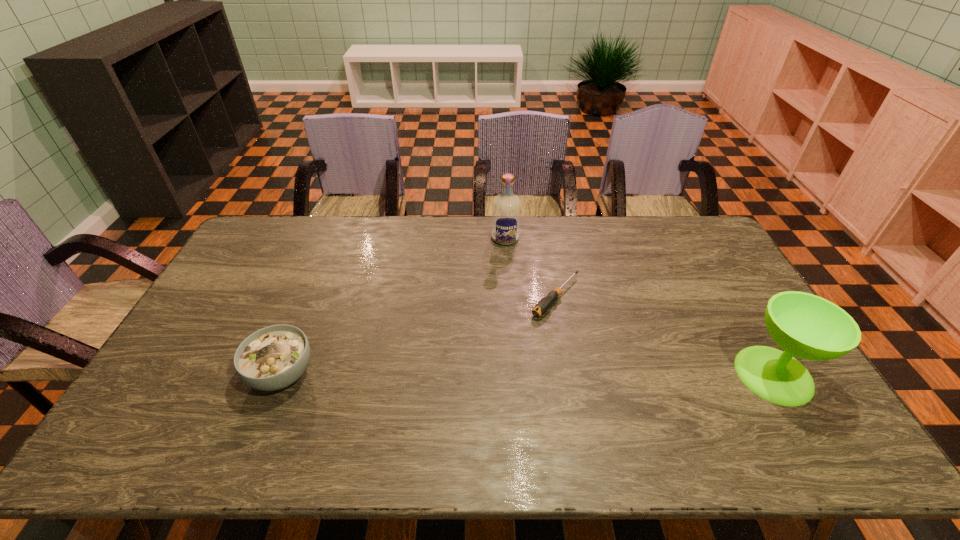
This screenshot has height=540, width=960. I want to click on the second shortest object, so click(272, 358).

Image resolution: width=960 pixels, height=540 pixels. What are the coordinates of `soup bowl` in the screenshot? It's located at (272, 358).

Find the location of a particular element. the second tallest object is located at coordinates click(804, 325).

I want to click on the rightmost object, so click(804, 325).

Identify the location of vodka. The image size is (960, 540). (506, 208).

Locate an element on the screen. The height and width of the screenshot is (540, 960). the tallest object is located at coordinates (506, 208).

Locate an element on the screen. The image size is (960, 540). screwdriver is located at coordinates (544, 304).

The image size is (960, 540). In order to click on the third nearest object in this screenshot , I will do coord(544,304).

The image size is (960, 540). Find the location of `free space located on the right of the soup bowl`. free space located on the right of the soup bowl is located at coordinates (439, 374).

Find the location of `vacant area located 0.380m on the left of the third shortest object`. vacant area located 0.380m on the left of the third shortest object is located at coordinates pos(596,375).